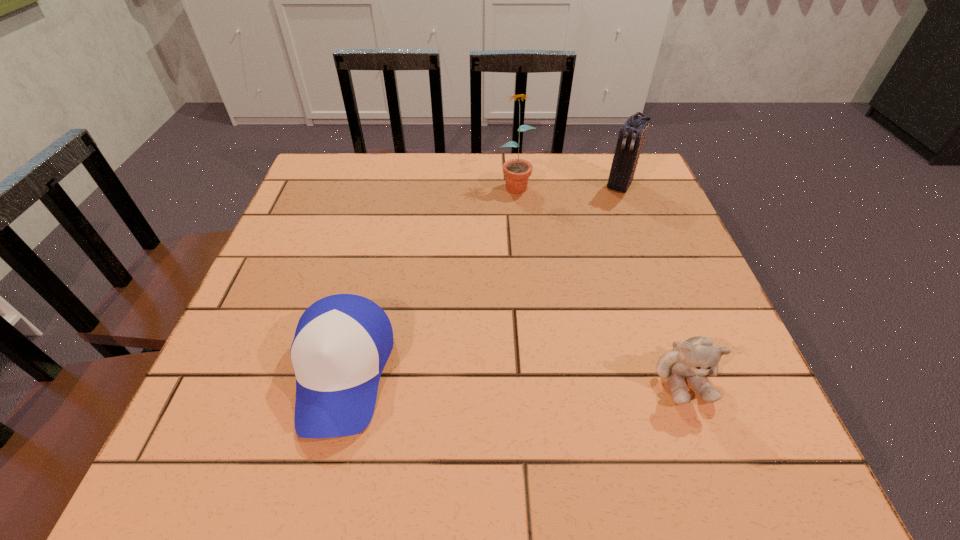
The height and width of the screenshot is (540, 960). In order to click on free point between the second tallest object and the teddy bear in this screenshot , I will do `click(651, 281)`.

I want to click on vacant point located between the clutch bag and the second object from left to right, so click(x=567, y=184).

You are a GUI agent. You are given a task and a screenshot of the screen. Output one action in this format:
    pyautogui.click(x=<x>, y=<y>)
    Task: Click on the free space between the teddy bear and the third object from right to left
    Image resolution: width=960 pixels, height=540 pixels.
    Given the screenshot: What is the action you would take?
    tap(599, 281)

At what (x,y) coordinates should I click in order to perform the action: click on empty space that is in between the baseball cap and the third shortest object. Please return your answer as a coordinate pair (x, y). The height and width of the screenshot is (540, 960). Looking at the image, I should click on (481, 279).

What are the coordinates of `free space between the tallest object and the baseball cap` in the screenshot? It's located at (429, 278).

Where is `free spot between the teddy bear and the tallest object`? free spot between the teddy bear and the tallest object is located at coordinates (599, 281).

Where is `free space that is in between the sunflower and the clutch bag`? free space that is in between the sunflower and the clutch bag is located at coordinates (567, 184).

What are the coordinates of `free space between the baseball cap and the tallest object` in the screenshot? It's located at (429, 278).

Image resolution: width=960 pixels, height=540 pixels. Find the location of `free space between the third object from right to left and the teddy bear`. free space between the third object from right to left and the teddy bear is located at coordinates (599, 281).

Where is `object that ranks as the second closest to the teddy bear`? The width and height of the screenshot is (960, 540). object that ranks as the second closest to the teddy bear is located at coordinates (631, 136).